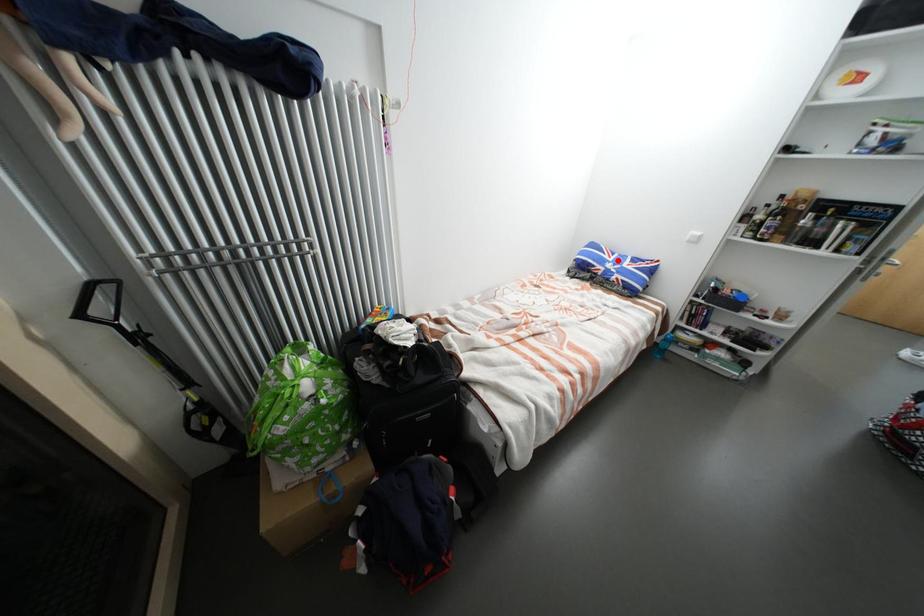
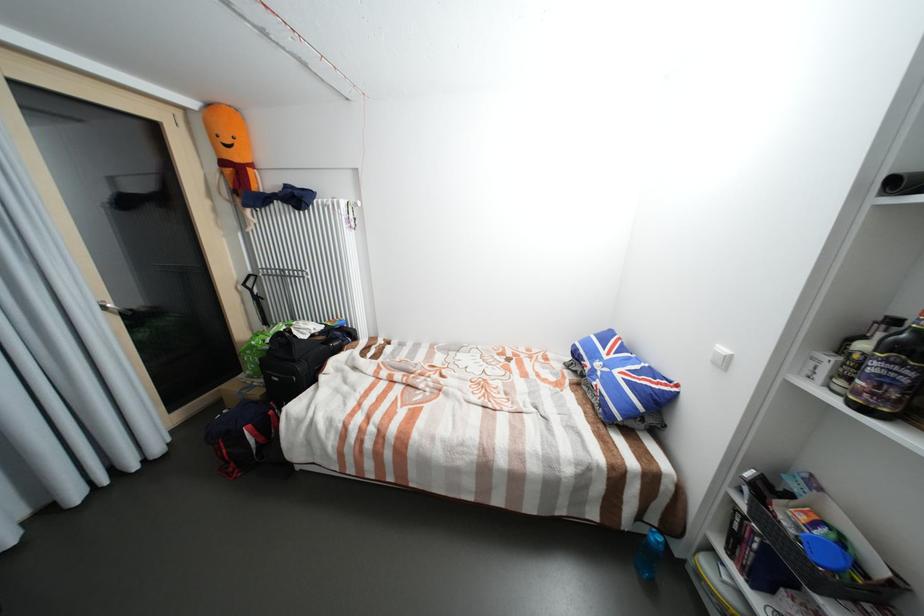
Question: I am providing you with two images of the same scene from different viewpoints. Image1 has a red point marked. In image2, the corresponding 3D location appears at what relative position? Reply with the corresponding letter.

Choices:
 (A) Closer
 (B) Farther

Answer: (B)